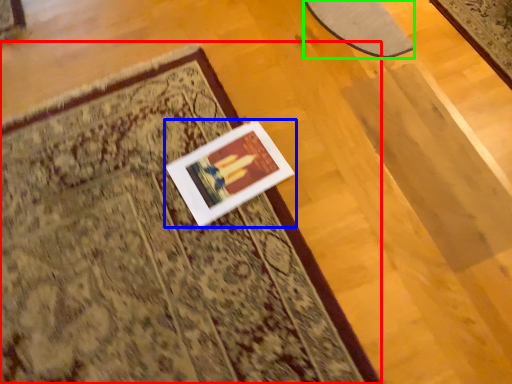
Question: Which is nearer to the mat (highlighted by a red box)? picture frame (highlighted by a blue box) or mat (highlighted by a green box).

Choices:
 (A) picture frame
 (B) mat

Answer: (A)